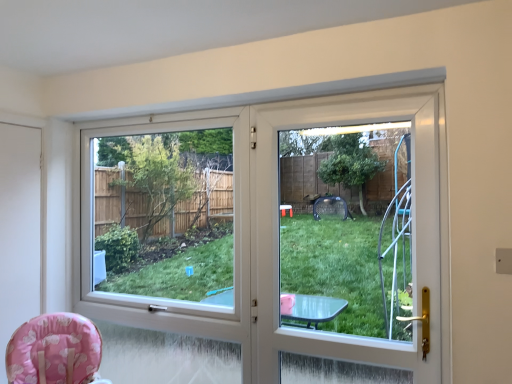
Question: Is transparent plastic window screen at center at the left side of pink fabric baby chair at lower left?

Choices:
 (A) no
 (B) yes

Answer: (A)

Question: From the image's perspective, is transparent plastic window screen at center beneath pink fabric baby chair at lower left?

Choices:
 (A) yes
 (B) no

Answer: (B)

Question: From a real-world perspective, is transparent plastic window screen at center located higher than pink fabric baby chair at lower left?

Choices:
 (A) no
 (B) yes

Answer: (B)

Question: Can you confirm if transparent plastic window screen at center is thinner than pink fabric baby chair at lower left?

Choices:
 (A) yes
 (B) no

Answer: (A)

Question: Can you confirm if transparent plastic window screen at center is positioned to the right of pink fabric baby chair at lower left?

Choices:
 (A) yes
 (B) no

Answer: (A)

Question: Is transparent plastic window screen at center shorter than pink fabric baby chair at lower left?

Choices:
 (A) yes
 (B) no

Answer: (B)

Question: Does transparent plastic window screen at center have a greater height compared to white plastic screen door at center, acting as the 2th screen door starting from the back?

Choices:
 (A) yes
 (B) no

Answer: (A)

Question: Is transparent plastic window screen at center oriented towards white plastic screen door at center, which appears as the 1th screen door when viewed from the right?

Choices:
 (A) yes
 (B) no

Answer: (B)

Question: Is the position of transparent plastic window screen at center more distant than that of white plastic screen door at center, which appears as the 1th screen door when viewed from the right?

Choices:
 (A) yes
 (B) no

Answer: (A)

Question: Are transparent plastic window screen at center and white plastic screen door at center, placed as the first screen door when sorted from front to back, making contact?

Choices:
 (A) no
 (B) yes

Answer: (A)

Question: Does transparent plastic window screen at center lie in front of white plastic screen door at center, which appears as the 1th screen door when viewed from the right?

Choices:
 (A) no
 (B) yes

Answer: (A)

Question: From the image's perspective, is transparent plastic window screen at center below white plastic screen door at center, placed as the first screen door when sorted from front to back?

Choices:
 (A) no
 (B) yes

Answer: (B)

Question: Is there a large distance between pink fabric baby chair at lower left and white matte screen door at left, marked as the first screen door in a back-to-front arrangement?

Choices:
 (A) yes
 (B) no

Answer: (B)